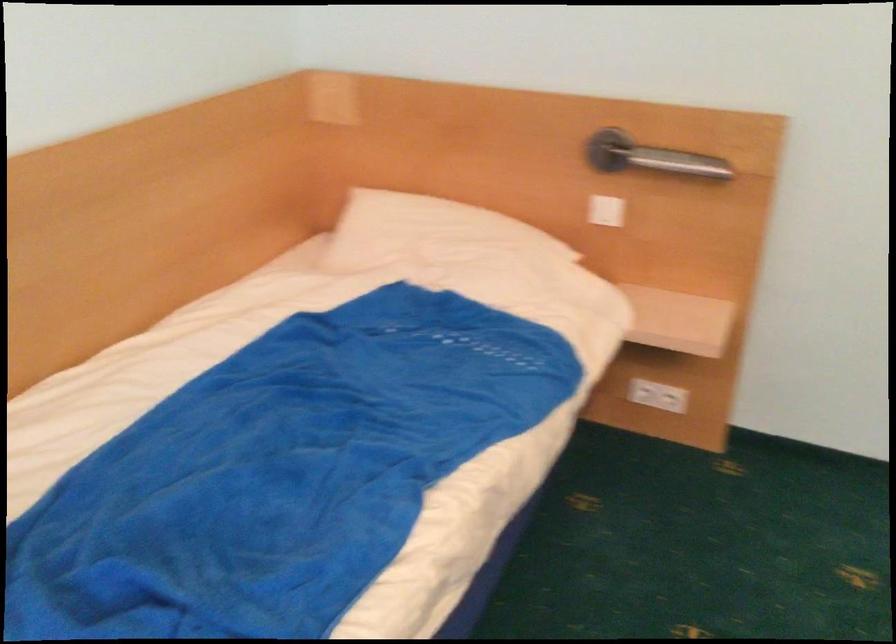
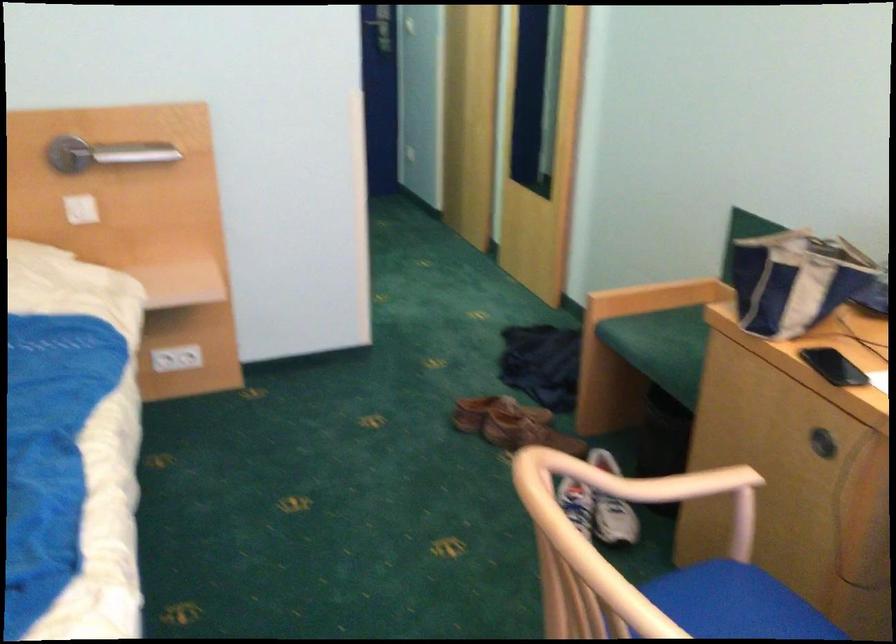
Locate, in the second image, the point that corresponds to [616,205] in the first image.

(81, 209)